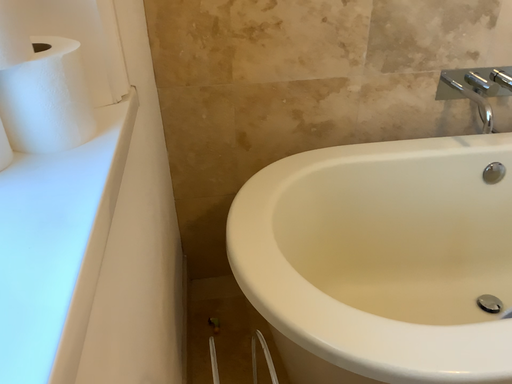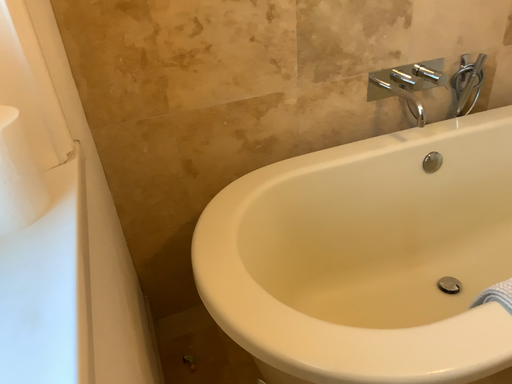
Question: How did the camera likely rotate when shooting the video?

Choices:
 (A) rotated left
 (B) rotated right

Answer: (B)